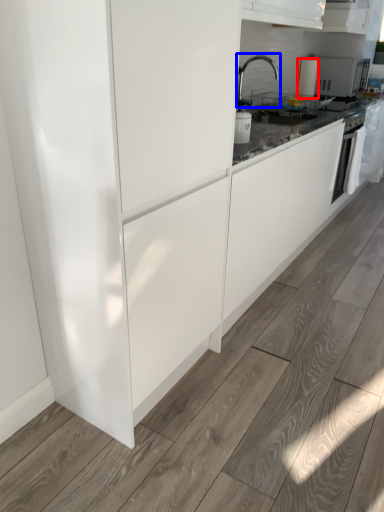
Question: Which point is closer to the camera, kitchen appliance (highlighted by a red box) or tap (highlighted by a blue box)?

Choices:
 (A) kitchen appliance
 (B) tap

Answer: (B)